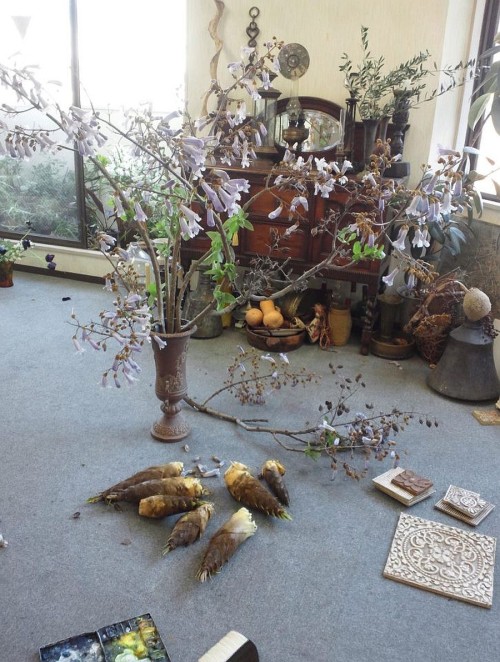
Find the location of a particular element. This screenshot has width=500, height=662. tall black candlestick is located at coordinates (401, 122).